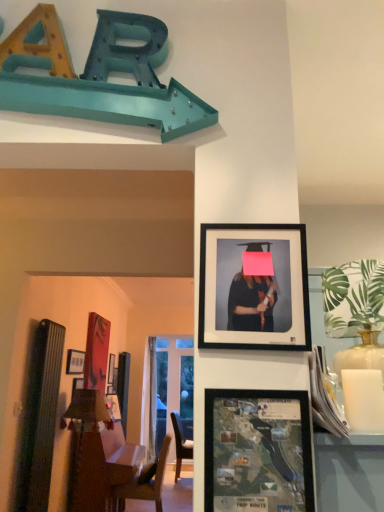
Question: From the image's perspective, is wooden bulletin board at left positioned above or below matte plastic map at center, the 2th picture frame in the bottom-to-top sequence?

Choices:
 (A) below
 (B) above

Answer: (A)

Question: From a real-world perspective, is wooden bulletin board at left physically located above or below matte plastic map at center, which appears as the third picture frame when viewed from the back?

Choices:
 (A) above
 (B) below

Answer: (B)

Question: Considering the real-world distances, which object is farthest from the matte black picture frame at upper left, the third picture frame viewed from the front?

Choices:
 (A) matte black frame at upper center, positioned as the first picture frame in top-to-bottom order
 (B) matte plastic map at center, the 2th picture frame in the bottom-to-top sequence
 (C) wooden bulletin board at left

Answer: (B)

Question: Which of these objects is positioned closest to the matte black frame at upper center, positioned as the 1th picture frame in right-to-left order?

Choices:
 (A) wooden bulletin board at left
 (B) matte black picture frame at upper left, acting as the third picture frame starting from the right
 (C) matte plastic map at center, which is the first picture frame from front to back

Answer: (C)